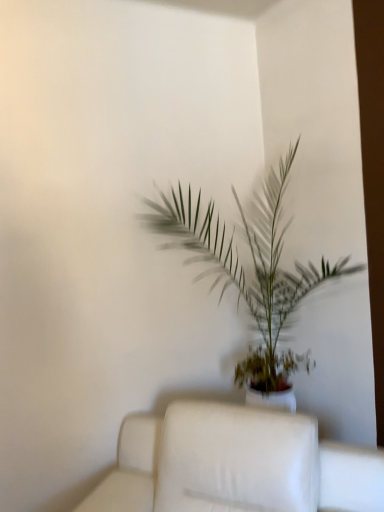
Question: Considering the positions of white fabric couch at center and green leafy plant at center in the image, is white fabric couch at center taller or shorter than green leafy plant at center?

Choices:
 (A) tall
 (B) short

Answer: (B)

Question: Is point (205, 420) closer or farther from the camera than point (266, 224)?

Choices:
 (A) farther
 (B) closer

Answer: (B)

Question: Is white fabric couch at center to the left or to the right of green leafy plant at center in the image?

Choices:
 (A) left
 (B) right

Answer: (A)

Question: Is green leafy plant at center bigger or smaller than white fabric couch at center?

Choices:
 (A) small
 (B) big

Answer: (B)

Question: In terms of width, does green leafy plant at center look wider or thinner when compared to white fabric couch at center?

Choices:
 (A) thin
 (B) wide

Answer: (A)

Question: Choose the correct answer: Is green leafy plant at center inside white fabric couch at center or outside it?

Choices:
 (A) outside
 (B) inside

Answer: (A)

Question: Is point (236, 253) closer or farther from the camera than point (157, 509)?

Choices:
 (A) farther
 (B) closer

Answer: (A)